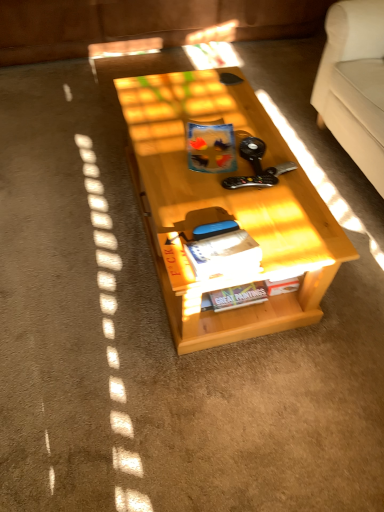
Where is `vacant space behind matte paper magazine at center`? Image resolution: width=384 pixels, height=512 pixels. vacant space behind matte paper magazine at center is located at coordinates (228, 210).